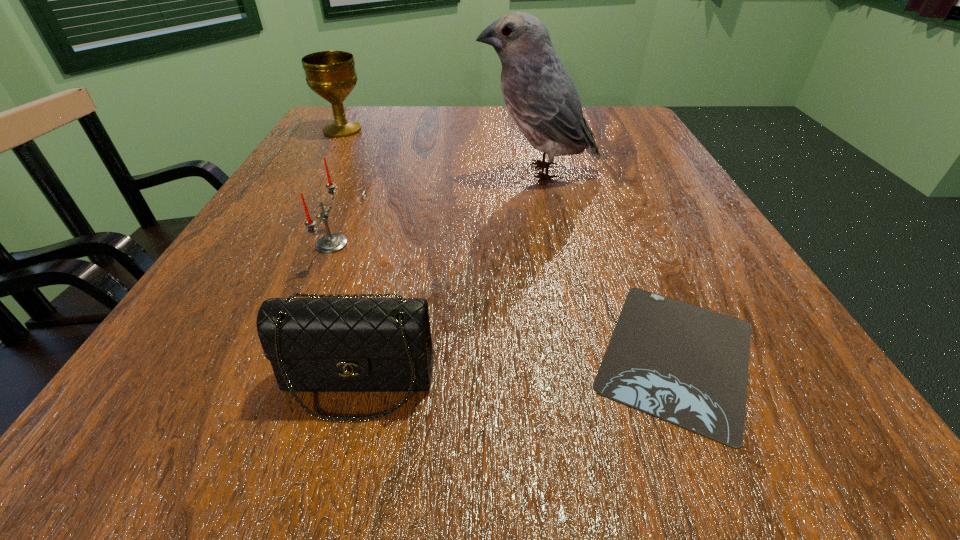
Identify the location of free region located on the front of the chalice. This screenshot has height=540, width=960. (331, 149).

This screenshot has height=540, width=960. What are the coordinates of `blank space located 0.090m on the front-facing side of the candle` in the screenshot? It's located at (402, 244).

Locate an element on the screen. This screenshot has width=960, height=540. vacant space situated 0.200m on the back of the shortest object is located at coordinates (616, 213).

Locate an element on the screen. object positioned at the far edge is located at coordinates (331, 74).

Identify the location of clutch bag that is at the near edge. (322, 343).

The width and height of the screenshot is (960, 540). I want to click on mousepad at the near edge, so click(x=687, y=365).

You are a GUI agent. You are given a task and a screenshot of the screen. Output one action in this format:
    pyautogui.click(x=<x>, y=<y>)
    Task: Click on the chalice that is positioned at the left edge
    This screenshot has height=540, width=960.
    Given the screenshot: What is the action you would take?
    pyautogui.click(x=331, y=74)

At what (x,y) coordinates should I click in order to perform the action: click on candle positioned at the left edge. Please return your answer as a coordinate pair (x, y). This screenshot has height=540, width=960. Looking at the image, I should click on tap(330, 243).

The width and height of the screenshot is (960, 540). In order to click on parrot that is at the right edge in this screenshot , I will do pos(540,95).

The height and width of the screenshot is (540, 960). In order to click on mousepad at the right edge in this screenshot , I will do `click(687, 365)`.